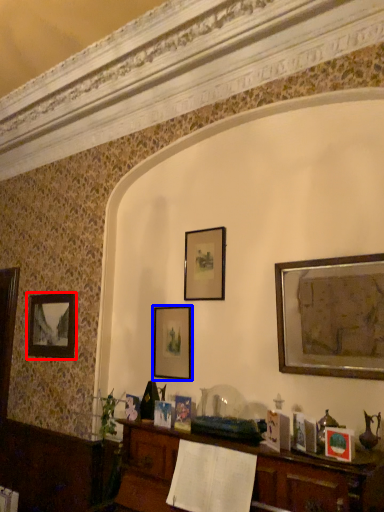
Question: Which of the following is the farthest to the observer, picture frame (highlighted by a red box) or picture frame (highlighted by a blue box)?

Choices:
 (A) picture frame
 (B) picture frame

Answer: (A)